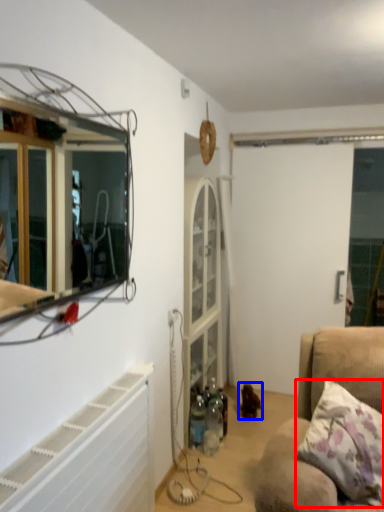
Question: Which object appears farthest to the camera in this image, pillow (highlighted by a red box) or toy (highlighted by a blue box)?

Choices:
 (A) pillow
 (B) toy

Answer: (B)